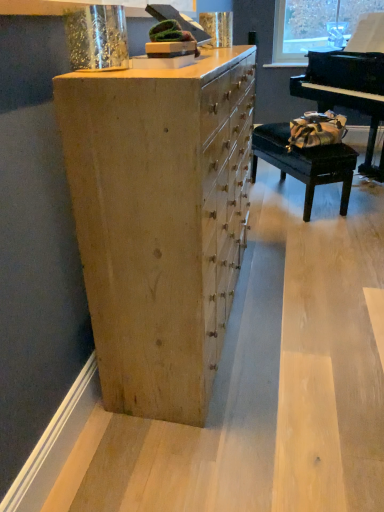
Describe the element at coordinates (347, 91) in the screenshot. I see `black polished piano at right` at that location.

What do you see at coordinates (305, 162) in the screenshot? Image resolution: width=384 pixels, height=512 pixels. I see `black leather table at right` at bounding box center [305, 162].

In order to click on black polished piano at right in this screenshot , I will do `click(347, 91)`.

Is the position of black leather table at right less distant than that of natural wood chest of drawers at center?

No, black leather table at right is behind natural wood chest of drawers at center.

Measure the distance between black leather table at right and natural wood chest of drawers at center.

black leather table at right and natural wood chest of drawers at center are 2.44 meters apart from each other.

Considering the relative positions of black leather table at right and natural wood chest of drawers at center in the image provided, is black leather table at right to the left of natural wood chest of drawers at center from the viewer's perspective?

No, black leather table at right is not to the left of natural wood chest of drawers at center.

Would you say black leather table at right is a long distance from natural wood chest of drawers at center?

Yes, black leather table at right and natural wood chest of drawers at center are quite far apart.

Is black polished piano at right completely or partially inside black leather table at right?

No, black polished piano at right is not a part of black leather table at right.

Is black leather table at right positioned in front of black polished piano at right?

No, black leather table at right is behind black polished piano at right.

Is black leather table at right beside black polished piano at right?

black leather table at right is not next to black polished piano at right, and they're not touching.

From their relative heights in the image, would you say natural wood chest of drawers at center is taller or shorter than black polished piano at right?

In the image, natural wood chest of drawers at center appears to be shorter than black polished piano at right.

Can you confirm if natural wood chest of drawers at center is wider than black polished piano at right?

No, natural wood chest of drawers at center is not wider than black polished piano at right.

Can black polished piano at right be found inside natural wood chest of drawers at center?

→ No, black polished piano at right is not surrounded by natural wood chest of drawers at center.

Are natural wood chest of drawers at center and black polished piano at right far apart?

Yes.

Who is bigger, natural wood chest of drawers at center or black leather table at right?

Bigger between the two is natural wood chest of drawers at center.

From the image's perspective, is natural wood chest of drawers at center positioned above or below black leather table at right?

natural wood chest of drawers at center is below black leather table at right.

Does natural wood chest of drawers at center lie in front of black leather table at right?

Yes, it is.

Considering the relative positions of natural wood chest of drawers at center and black leather table at right in the image provided, is natural wood chest of drawers at center to the left of black leather table at right from the viewer's perspective?

Indeed, natural wood chest of drawers at center is positioned on the left side of black leather table at right.

Measure the distance between black polished piano at right and natural wood chest of drawers at center.

The distance of black polished piano at right from natural wood chest of drawers at center is 6.72 feet.

From the image's perspective, would you say black polished piano at right is positioned over natural wood chest of drawers at center?

Yes.

From a real-world perspective, is black polished piano at right over natural wood chest of drawers at center?

Correct, in the physical world, black polished piano at right is higher than natural wood chest of drawers at center.

Is black polished piano at right further to camera compared to black leather table at right?

No, it is not.

From a real-world perspective, is black polished piano at right physically located above or below black leather table at right?

Clearly, from a real-world perspective, black polished piano at right is above black leather table at right.

Could you tell me if black polished piano at right is turned towards black leather table at right?

Yes, black polished piano at right is turned towards black leather table at right.

Identify the location of table that is above the natural wood chest of drawers at center (from the image's perspective). (305, 162).

The image size is (384, 512). What are the coordinates of `table below the black polished piano at right (from a real-world perspective)` in the screenshot? It's located at (305, 162).

From the image, which object appears to be nearer to black polished piano at right, natural wood chest of drawers at center or black leather table at right?

black leather table at right is positioned closer to the anchor black polished piano at right.

Considering their positions, is black leather table at right positioned further to black polished piano at right than natural wood chest of drawers at center?

natural wood chest of drawers at center lies further to black polished piano at right than the other object.

Which object lies nearer to the anchor point natural wood chest of drawers at center, black polished piano at right or black leather table at right?

black polished piano at right lies closer to natural wood chest of drawers at center than the other object.

Estimate the real-world distances between objects in this image. Which object is closer to black leather table at right, natural wood chest of drawers at center or black polished piano at right?

black polished piano at right lies closer to black leather table at right than the other object.

Which object lies further to the anchor point black leather table at right, black polished piano at right or natural wood chest of drawers at center?

natural wood chest of drawers at center.

Considering their positions, is black leather table at right positioned further to natural wood chest of drawers at center than black polished piano at right?

black leather table at right lies further to natural wood chest of drawers at center than the other object.

The width and height of the screenshot is (384, 512). What are the coordinates of `piano between natural wood chest of drawers at center and black leather table at right in the front-back direction` in the screenshot? It's located at (347, 91).